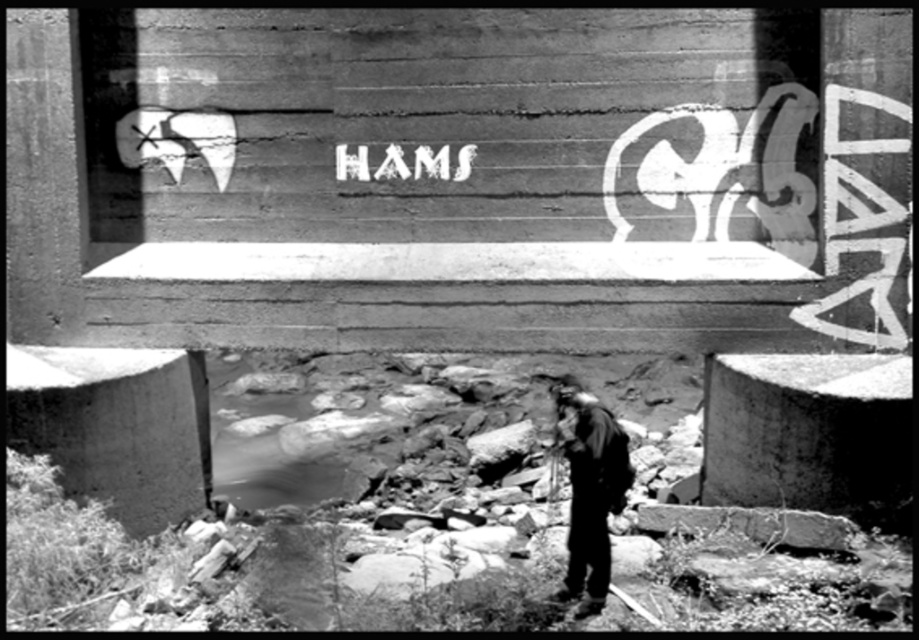
Question: Which point is farther to the camera?

Choices:
 (A) white matte text at center
 (B) dark gray fabric jacket at lower center

Answer: (A)

Question: Which point is closer to the camera?

Choices:
 (A) white matte text at center
 (B) dark gray fabric jacket at lower center

Answer: (B)

Question: Can you confirm if dark gray fabric jacket at lower center is positioned above white matte text at center?

Choices:
 (A) yes
 (B) no

Answer: (B)

Question: Can you confirm if dark gray fabric jacket at lower center is smaller than white matte text at center?

Choices:
 (A) no
 (B) yes

Answer: (A)

Question: Can you confirm if dark gray fabric jacket at lower center is positioned below white matte text at center?

Choices:
 (A) no
 (B) yes

Answer: (B)

Question: Which object is closer to the camera taking this photo?

Choices:
 (A) white matte text at center
 (B) dark gray fabric jacket at lower center

Answer: (B)